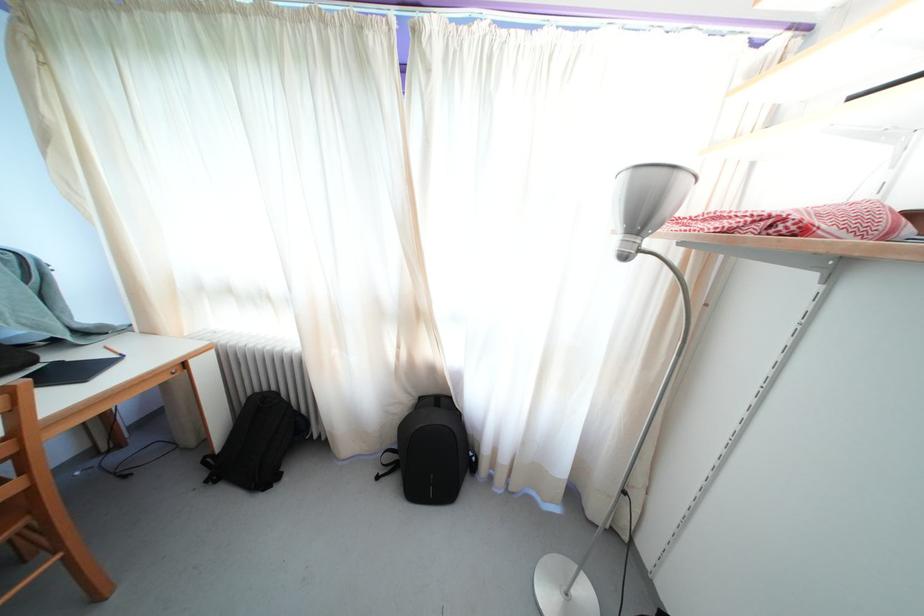
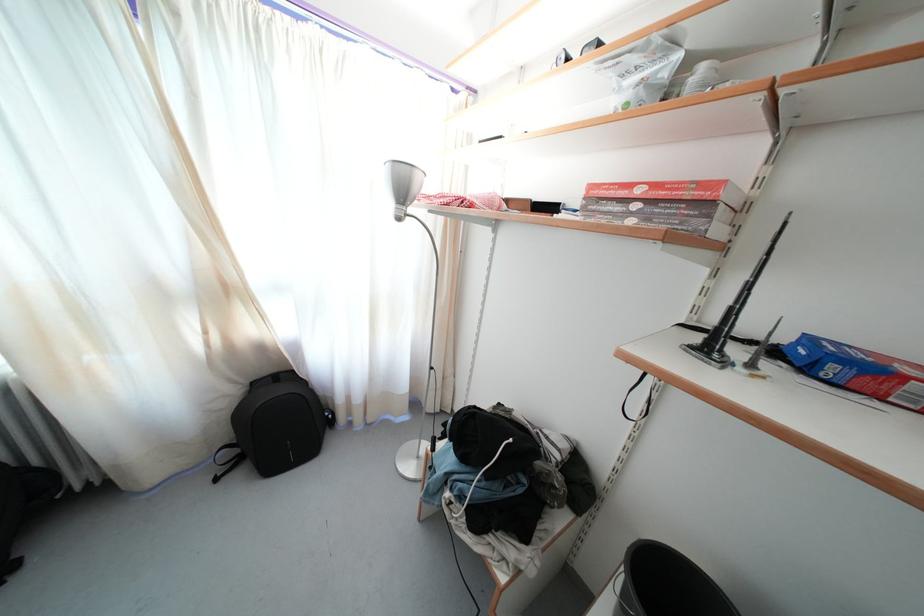
Where in the second image is the point corresponding to [427,405] from the first image?

(259, 390)